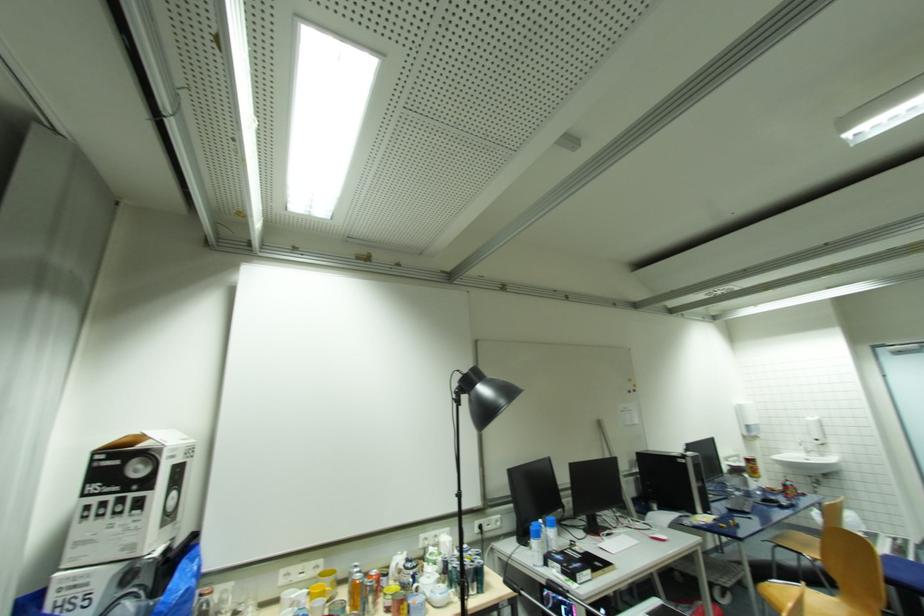
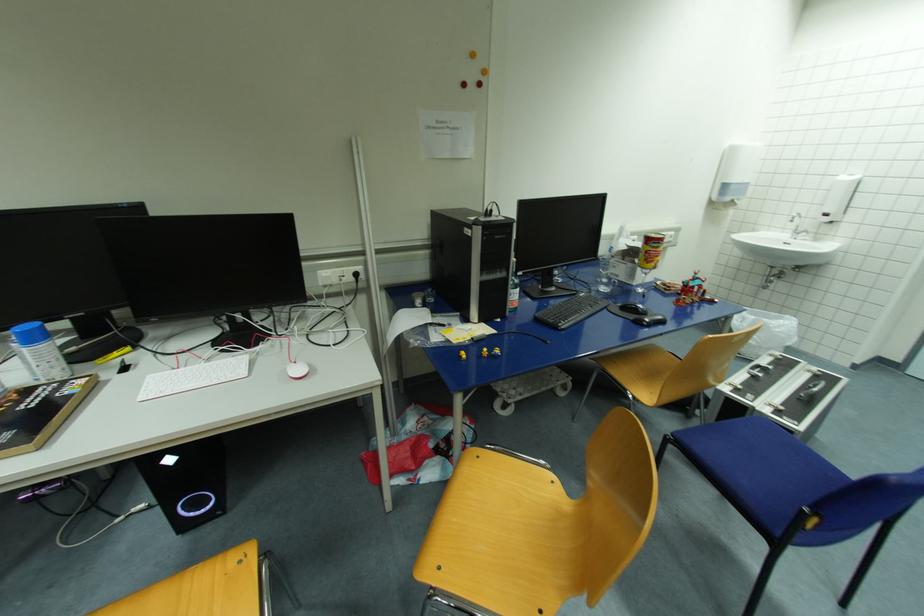
In the second image, find the point that corresponds to pixel 792 485 in the first image.

(696, 285)